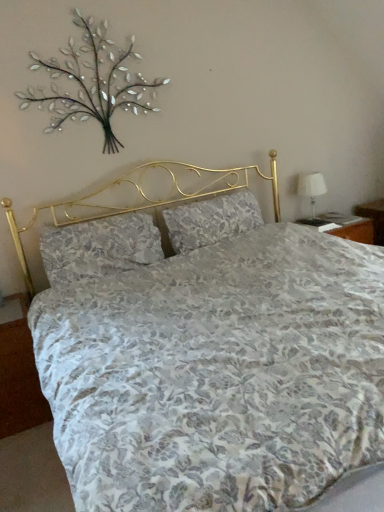
Question: From the image's perspective, does metallic silver branches at upper left appear lower than white fabric lampshade at right?

Choices:
 (A) yes
 (B) no

Answer: (B)

Question: Is metallic silver branches at upper left facing away from white fabric lampshade at right?

Choices:
 (A) yes
 (B) no

Answer: (B)

Question: Is metallic silver branches at upper left thinner than white fabric lampshade at right?

Choices:
 (A) yes
 (B) no

Answer: (A)

Question: Is metallic silver branches at upper left at the left side of white fabric lampshade at right?

Choices:
 (A) no
 (B) yes

Answer: (B)

Question: Is the depth of metallic silver branches at upper left less than that of white fabric lampshade at right?

Choices:
 (A) no
 (B) yes

Answer: (B)

Question: From their relative heights in the image, would you say metallic silver branches at upper left is taller or shorter than floral fabric pillow at center, which ranks as the 1th pillow in left-to-right order?

Choices:
 (A) short
 (B) tall

Answer: (B)

Question: Would you say metallic silver branches at upper left is to the left or to the right of floral fabric pillow at center, positioned as the 2th pillow in right-to-left order, in the picture?

Choices:
 (A) left
 (B) right

Answer: (A)

Question: Considering the positions of point (66, 74) and point (97, 271), is point (66, 74) closer or farther from the camera than point (97, 271)?

Choices:
 (A) closer
 (B) farther

Answer: (A)

Question: Looking at the image, does metallic silver branches at upper left seem bigger or smaller compared to floral fabric pillow at center, which ranks as the 1th pillow in left-to-right order?

Choices:
 (A) small
 (B) big

Answer: (A)

Question: Is metallic silver branches at upper left taller or shorter than floral fabric pillow at center, which is counted as the 2th pillow, starting from the left?

Choices:
 (A) short
 (B) tall

Answer: (B)

Question: Considering the positions of metallic silver branches at upper left and floral fabric pillow at center, which is counted as the 2th pillow, starting from the left, in the image, is metallic silver branches at upper left bigger or smaller than floral fabric pillow at center, which is counted as the 2th pillow, starting from the left,?

Choices:
 (A) big
 (B) small

Answer: (B)

Question: Relative to floral fabric pillow at center, which is counted as the 2th pillow, starting from the left, is metallic silver branches at upper left in front or behind?

Choices:
 (A) behind
 (B) front

Answer: (B)

Question: Is point (39, 102) positioned closer to the camera than point (251, 202)?

Choices:
 (A) farther
 (B) closer

Answer: (B)

Question: Looking at the image, does floral fabric pillow at center, positioned as the 1th pillow in right-to-left order, seem bigger or smaller compared to metallic silver branches at upper left?

Choices:
 (A) small
 (B) big

Answer: (B)

Question: Relative to metallic silver branches at upper left, is floral fabric pillow at center, positioned as the 1th pillow in right-to-left order, in front or behind?

Choices:
 (A) front
 (B) behind

Answer: (B)